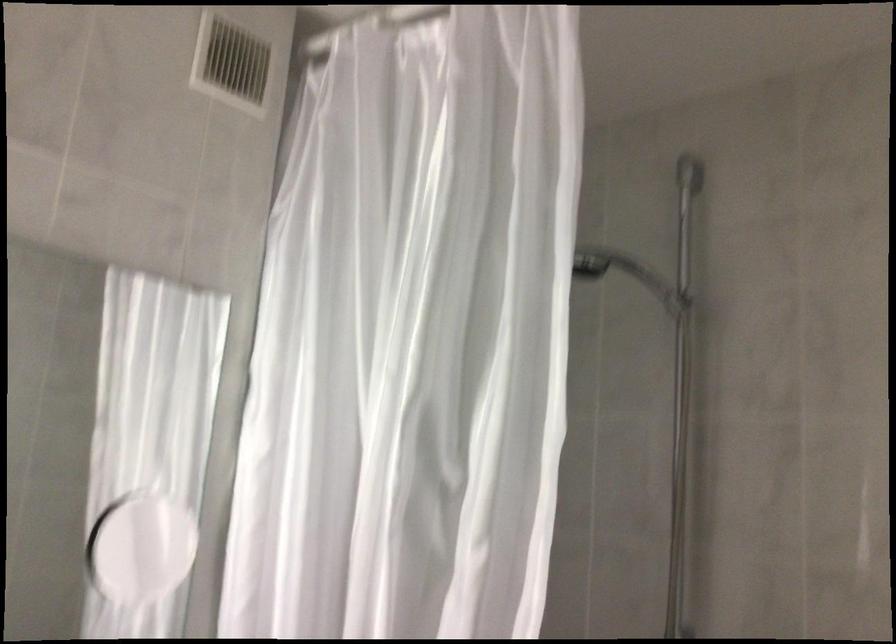
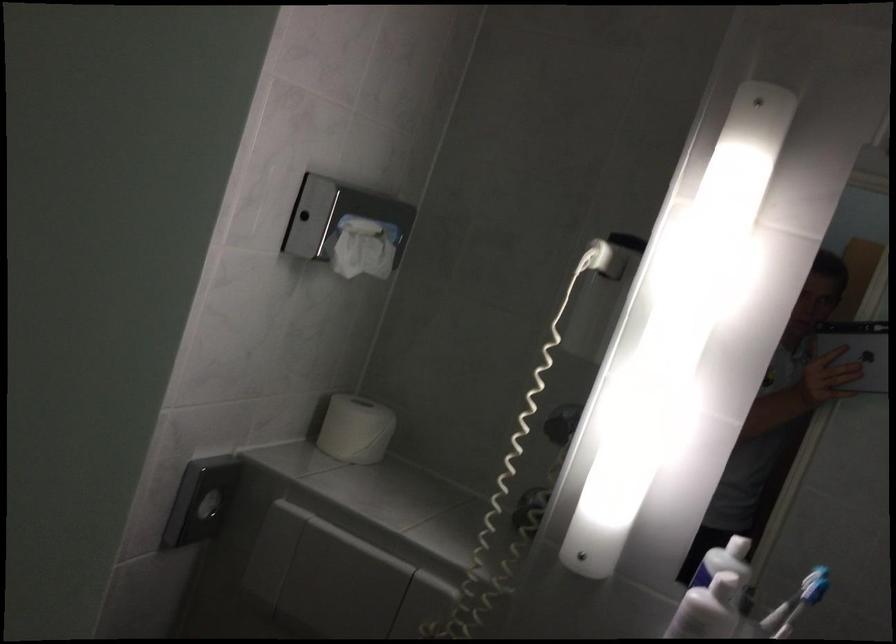
Question: Based on the continuous images, in which direction is the camera rotating? Reply with the corresponding letter.

Choices:
 (A) Left
 (B) Right
 (C) Up
 (D) Down

Answer: (A)